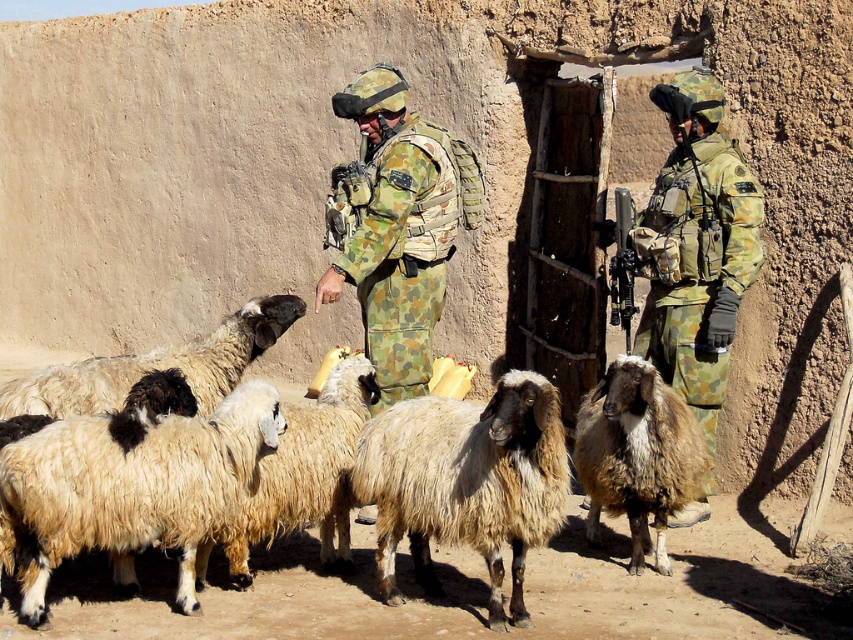
You are a photographer trying to capture a clear shot of the fuzzy beige wool at center and the fuzzy woolen sheep at center. Which one would you need to focus on more carefully to ensure it appears sharp in the photo?

The fuzzy beige wool at center is larger in size than the fuzzy woolen sheep at center, so you would need to focus more carefully on the fuzzy woolen sheep at center to ensure it appears sharp in the photo.

What is the 2D coordinate of the fuzzy woolen sheep at lower left?

The fuzzy woolen sheep at lower left is located at the 2D coordinate point of (132, 484).